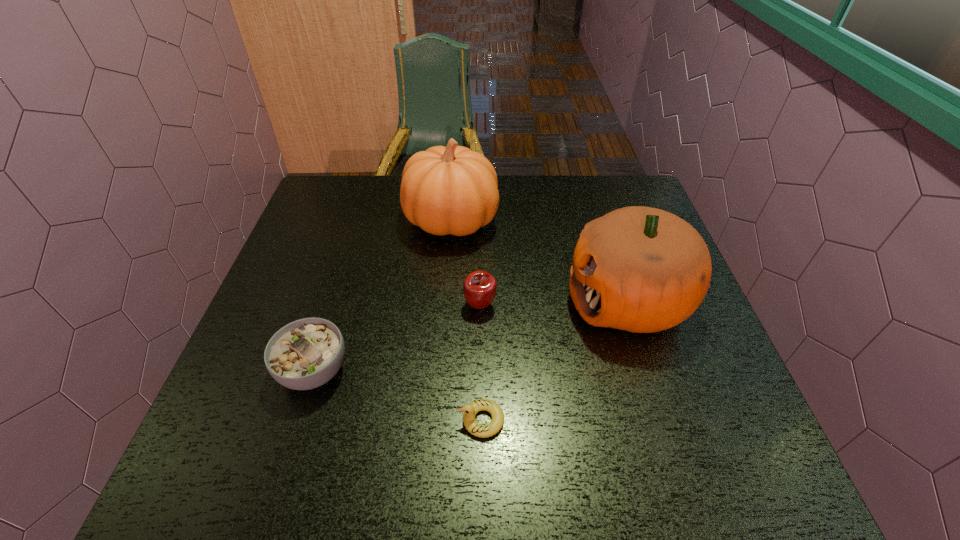
At what (x,y) coordinates should I click in order to perform the action: click on the left pumpkin. Please return your answer as a coordinate pair (x, y). Looking at the image, I should click on (453, 190).

The width and height of the screenshot is (960, 540). I want to click on the farther pumpkin, so coord(453,190).

What are the coordinates of `the right pumpkin` in the screenshot? It's located at (640, 269).

This screenshot has height=540, width=960. What are the coordinates of `the nearer pumpkin` in the screenshot? It's located at (640, 269).

Locate an element on the screen. This screenshot has width=960, height=540. apple is located at coordinates (479, 289).

Where is `soup bowl`? soup bowl is located at coordinates (305, 354).

Where is `duckling`? Image resolution: width=960 pixels, height=540 pixels. duckling is located at coordinates (470, 410).

Locate an element on the screen. This screenshot has width=960, height=540. vacant space located 0.320m on the front of the farthest object is located at coordinates (442, 348).

What are the coordinates of `free space located 0.350m on the face of the right pumpkin` in the screenshot? It's located at (421, 300).

Image resolution: width=960 pixels, height=540 pixels. I want to click on free region located on the face of the right pumpkin, so click(508, 300).